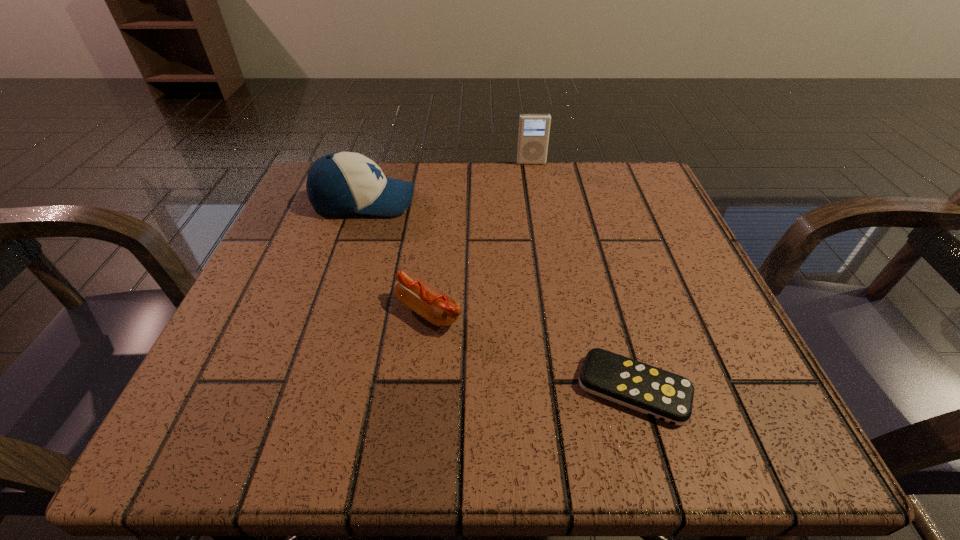
Where is `free point that satisfies the following two spatial constraints: 1. on the front-facing side of the second nearest object; 2. on the right side of the second farthest object`? The image size is (960, 540). free point that satisfies the following two spatial constraints: 1. on the front-facing side of the second nearest object; 2. on the right side of the second farthest object is located at coordinates (328, 311).

Identify the location of blank space that satisfies the following two spatial constraints: 1. on the front-facing side of the second shortest object; 2. on the left side of the third nearest object. The height and width of the screenshot is (540, 960). (328, 311).